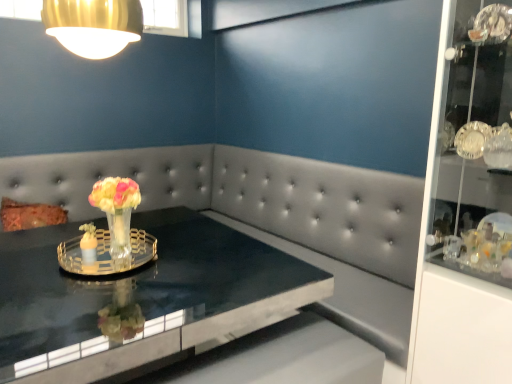
The image size is (512, 384). In order to click on vacant space to the right of translucent glass vase at center in this screenshot , I will do `click(178, 260)`.